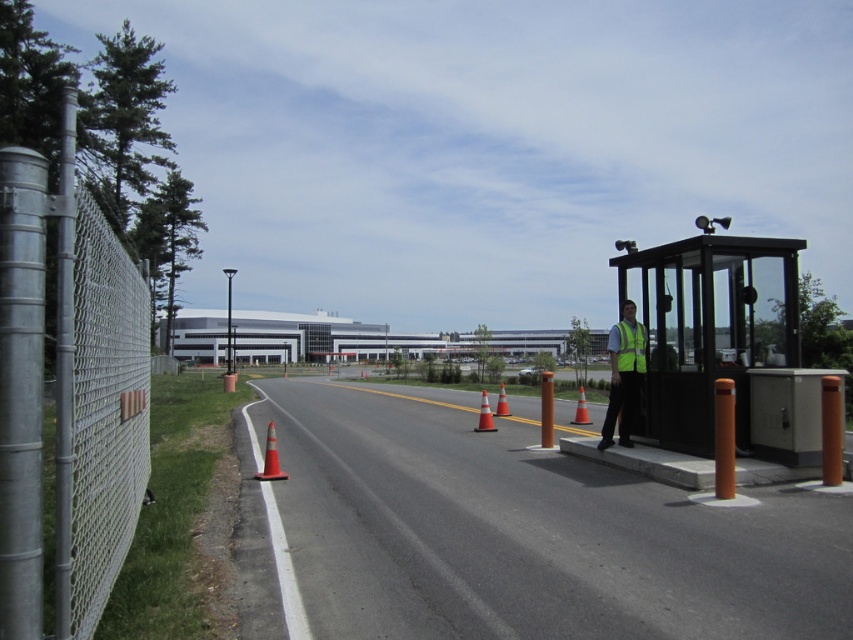
Question: Is asphalt road at center to the right of high visibility fabric safety vest at right from the viewer's perspective?

Choices:
 (A) no
 (B) yes

Answer: (A)

Question: Considering the real-world distances, which object is closest to the high visibility fabric safety vest at right?

Choices:
 (A) high visibility yellow vest at right
 (B) orange reflective cone at center
 (C) orange matte traffic cone at center
 (D) orange matte traffic cone at lower left

Answer: (A)

Question: Can you confirm if high visibility fabric safety vest at right is positioned below orange matte traffic cone at center?

Choices:
 (A) no
 (B) yes

Answer: (A)

Question: Which point is closer to the camera?

Choices:
 (A) (648, 301)
 (B) (506, 403)
 (C) (70, 609)
 (D) (590, 547)

Answer: (C)

Question: Which point is closer to the camera?

Choices:
 (A) (666, 506)
 (B) (627, 360)
 (C) (682, 332)
 (D) (85, 220)

Answer: (D)

Question: From the image, what is the correct spatial relationship of orange matte traffic cone at lower left in relation to orange reflective plastic traffic cone at center?

Choices:
 (A) right
 (B) left

Answer: (B)